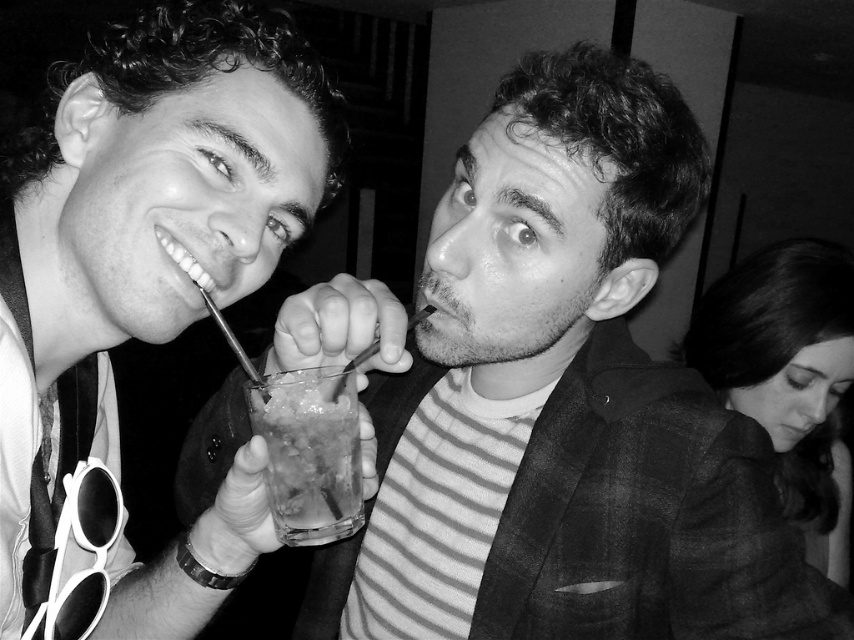
You are a photographer who wants to adjust the focus of your camera to capture a clear image of the man on the left holding a drink and the man on the right with a playful expression. Given that the point at coordinates point (103, 148) is 59.60 centimeters away from the camera, what is the minimum distance the camera should be focused at to ensure both men are in sharp focus?

The camera should be focused at 59.60 centimeters because the point at coordinates point (103, 148) is exactly 59.60 centimeters away from the camera, which is the closest point in the scene. To ensure both men are in focus, the focus distance should be set to this closest point, and the depth of field should be sufficient to cover the distance between them.

You are a photographer trying to capture a closeup of the translucent glass at center without the matte black drink at center blocking the view. Can you adjust your camera angle to achieve this?

The matte black drink at center is in front of the translucent glass at center, so you need to move your camera angle behind the drink to see the glass without obstruction.

You are a photographer trying to adjust the focus of your camera. You have two points in the image that need to be in focus. The first point is at coordinates point (241, 129) and the second is at point (332, 532). Since you can only focus on one point at a time, which point should you choose to ensure the closer object is in focus?

Point (241, 129) is closer to the viewer than point (332, 532), so you should focus on point (241, 129) to ensure the closer object is in focus.